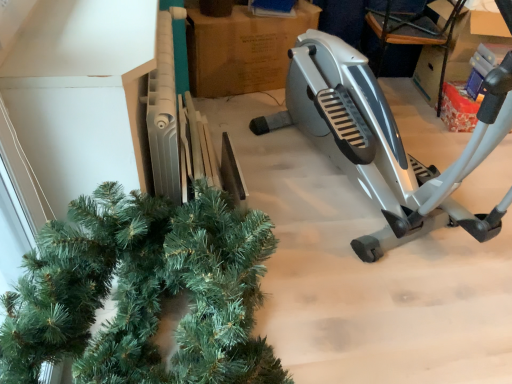
Question: Is silver metallic stationary bicycle at right bigger or smaller than brown cardboard at center?

Choices:
 (A) small
 (B) big

Answer: (B)

Question: Is point (497, 228) positioned closer to the camera than point (265, 49)?

Choices:
 (A) farther
 (B) closer

Answer: (B)

Question: In the image, is silver metallic stationary bicycle at right positioned in front of or behind brown cardboard at center?

Choices:
 (A) front
 (B) behind

Answer: (A)

Question: From their relative heights in the image, would you say brown cardboard at center is taller or shorter than silver metallic stationary bicycle at right?

Choices:
 (A) tall
 (B) short

Answer: (B)

Question: From a real-world perspective, is brown cardboard at center physically located above or below silver metallic stationary bicycle at right?

Choices:
 (A) above
 (B) below

Answer: (B)

Question: Is brown cardboard at center spatially inside silver metallic stationary bicycle at right, or outside of it?

Choices:
 (A) inside
 (B) outside

Answer: (B)

Question: In the image, is brown cardboard at center positioned in front of or behind silver metallic stationary bicycle at right?

Choices:
 (A) front
 (B) behind

Answer: (B)